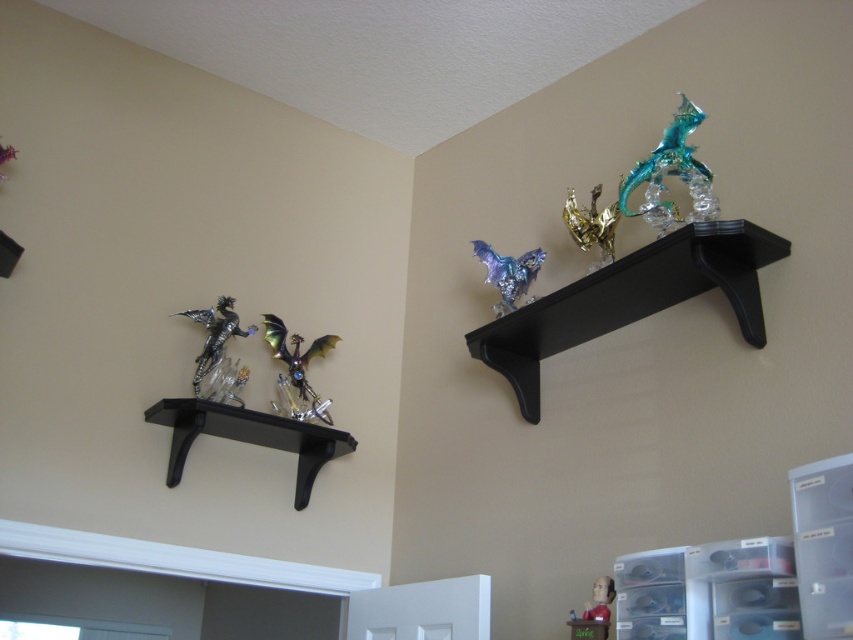
You are standing in front of two wall shelves. You need to reach a specific point marked at coordinates point (x=730, y=227). Can you estimate whether this point is within your arm reach? Assume your arm can extend up to 6 feet.

The distance of point (x=730, y=227) from camera is 5.63 feet, which is within your arm reach of 6 feet. Yes, you can reach it.

You are standing in a room and want to place a 6 feet long ladder against the wall. You see the black glossy shelf at upper right. Can you fit the ladder between the shelf and the wall without touching the shelf?

The black glossy shelf at upper right is 5.60 feet away from viewer. Since the ladder is 6 feet long, it would extend beyond the shelf, so placing it there would cause the ladder to touch the shelf. Therefore, it is not possible to fit the ladder without touching the shelf.

You are an interior designer planning to place a large sculpture that requires a shelf with a minimum size of 1.2 meters in width. Based on the scene, which shelf between the black glossy shelf at upper right and the black matte shelf at lower left would be suitable for the sculpture?

The black glossy shelf at upper right is bigger than the black matte shelf at lower left, so it would be suitable for the large sculpture requiring a minimum of 1.2 meters in width.